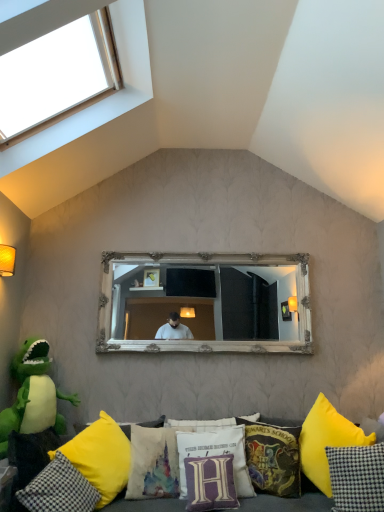
Question: Is yellow fabric couch at lower center to the left of yellow fabric pillow at lower left, placed as the eighth pillow when sorted from right to left, from the viewer's perspective?

Choices:
 (A) yes
 (B) no

Answer: (B)

Question: From a real-world perspective, is yellow fabric couch at lower center located higher than yellow fabric pillow at lower left, the 1th pillow in the left-to-right sequence?

Choices:
 (A) yes
 (B) no

Answer: (B)

Question: Is yellow fabric couch at lower center facing towards yellow fabric pillow at lower left, the 1th pillow in the left-to-right sequence?

Choices:
 (A) yes
 (B) no

Answer: (A)

Question: Is the position of yellow fabric couch at lower center more distant than that of yellow fabric pillow at lower left, the 1th pillow in the left-to-right sequence?

Choices:
 (A) yes
 (B) no

Answer: (B)

Question: Does yellow fabric couch at lower center have a lesser width compared to yellow fabric pillow at lower left, placed as the eighth pillow when sorted from right to left?

Choices:
 (A) yes
 (B) no

Answer: (B)

Question: Is matte yellow wall sconce at left wider or thinner than yellow fabric pillow at lower center, which appears as the second pillow when viewed from the left?

Choices:
 (A) wide
 (B) thin

Answer: (B)

Question: In terms of size, does matte yellow wall sconce at left appear bigger or smaller than yellow fabric pillow at lower center, which appears as the second pillow when viewed from the left?

Choices:
 (A) big
 (B) small

Answer: (B)

Question: Does point (6, 258) appear closer or farther from the camera than point (112, 444)?

Choices:
 (A) farther
 (B) closer

Answer: (A)

Question: Is matte yellow wall sconce at left spatially inside yellow fabric pillow at lower center, positioned as the 7th pillow in right-to-left order, or outside of it?

Choices:
 (A) inside
 (B) outside

Answer: (B)

Question: Is checkered fabric pillow at lower right, which is the 1th pillow from right to left, bigger or smaller than yellow fabric pillow at lower center, which appears as the second pillow when viewed from the left?

Choices:
 (A) small
 (B) big

Answer: (A)

Question: From a real-world perspective, is checkered fabric pillow at lower right, positioned as the eighth pillow in left-to-right order, above or below yellow fabric pillow at lower center, positioned as the 7th pillow in right-to-left order?

Choices:
 (A) above
 (B) below

Answer: (B)

Question: Do you think checkered fabric pillow at lower right, positioned as the eighth pillow in left-to-right order, is within yellow fabric pillow at lower center, which appears as the second pillow when viewed from the left, or outside of it?

Choices:
 (A) outside
 (B) inside

Answer: (A)

Question: Looking at their shapes, would you say checkered fabric pillow at lower right, positioned as the eighth pillow in left-to-right order, is wider or thinner than yellow fabric pillow at lower center, positioned as the 7th pillow in right-to-left order?

Choices:
 (A) wide
 (B) thin

Answer: (B)

Question: Is clear glass window at upper left inside the boundaries of checkered fabric pillow at lower right, positioned as the eighth pillow in left-to-right order, or outside?

Choices:
 (A) outside
 (B) inside

Answer: (A)

Question: Is clear glass window at upper left taller or shorter than checkered fabric pillow at lower right, which is the 1th pillow from right to left?

Choices:
 (A) short
 (B) tall

Answer: (B)